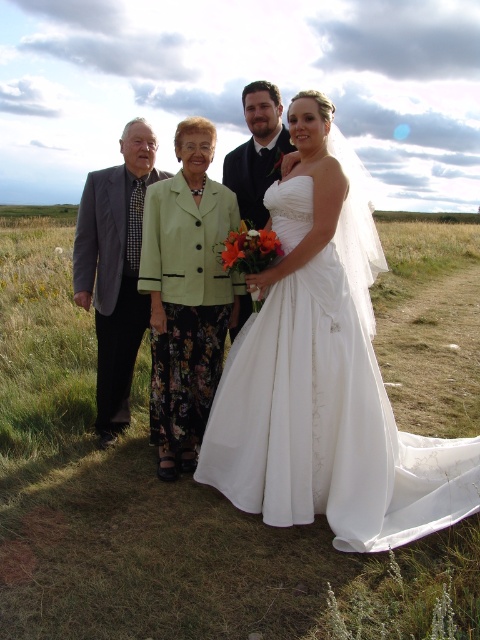
Between point (118, 173) and point (235, 170), which one is positioned behind?

Positioned behind is point (235, 170).

Which is more to the right, gray suit at left or matte black suit at center?

Positioned to the right is matte black suit at center.

Is point (132, 209) positioned in front of point (267, 168)?

Yes.

At what (x,y) coordinates should I click in order to perform the action: click on gray suit at left. Please return your answer as a coordinate pair (x, y). Image resolution: width=480 pixels, height=640 pixels. Looking at the image, I should click on (115, 268).

Is green fabric jacket at center to the left of gray suit at left from the viewer's perspective?

In fact, green fabric jacket at center is to the right of gray suit at left.

The height and width of the screenshot is (640, 480). I want to click on green fabric jacket at center, so click(187, 296).

Is point (157, 433) closer to viewer compared to point (136, 332)?

Yes, point (157, 433) is in front of point (136, 332).

This screenshot has height=640, width=480. I want to click on green fabric jacket at center, so pos(187,296).

How much distance is there between white satin wedding dress at center and green fabric jacket at center?

They are 29.49 inches apart.

Is white satin wedding dress at center bigger than green fabric jacket at center?

Indeed, white satin wedding dress at center has a larger size compared to green fabric jacket at center.

Is point (468, 496) farther from camera compared to point (193, 454)?

No, it is in front of (193, 454).

Locate an element on the screen. The height and width of the screenshot is (640, 480). white satin wedding dress at center is located at coordinates (326, 422).